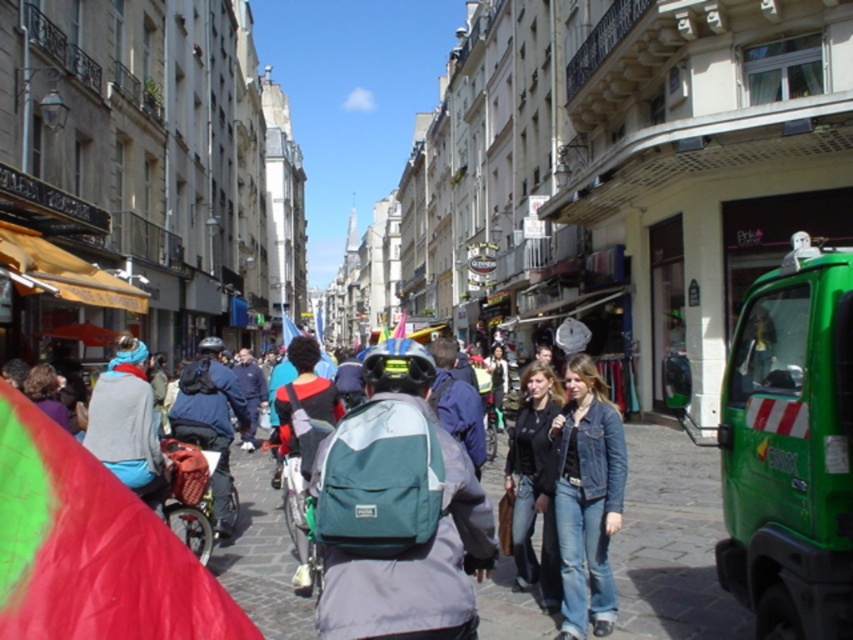
Which of these two, green matte truck at right or denim jacket at lower right, stands taller?

Standing taller between the two is denim jacket at lower right.

Between green matte truck at right and denim jacket at lower right, which one appears on the right side from the viewer's perspective?

Positioned to the right is green matte truck at right.

Looking at this image, who is more forward, (802,611) or (604,429)?

Positioned in front is point (802,611).

Identify the location of green matte truck at right. (786, 445).

Is denim jacket at center below jeans at center?

Yes, denim jacket at center is below jeans at center.

Which is below, denim jacket at center or jeans at center?

denim jacket at center

Between point (254, 580) and point (517, 582), which one is positioned in front?

Point (517, 582) is in front.

You are a GUI agent. You are given a task and a screenshot of the screen. Output one action in this format:
    pyautogui.click(x=<x>, y=<y>)
    Task: Click on the denim jacket at center
    The height and width of the screenshot is (640, 853).
    Given the screenshot: What is the action you would take?
    pyautogui.click(x=260, y=556)

Can you confirm if green matte truck at right is smaller than jeans at center?

Indeed, green matte truck at right has a smaller size compared to jeans at center.

Measure the distance between green matte truck at right and jeans at center.

2.58 meters

Locate an element on the screen. green matte truck at right is located at coordinates (786, 445).

Locate an element on the screen. green matte truck at right is located at coordinates (786, 445).